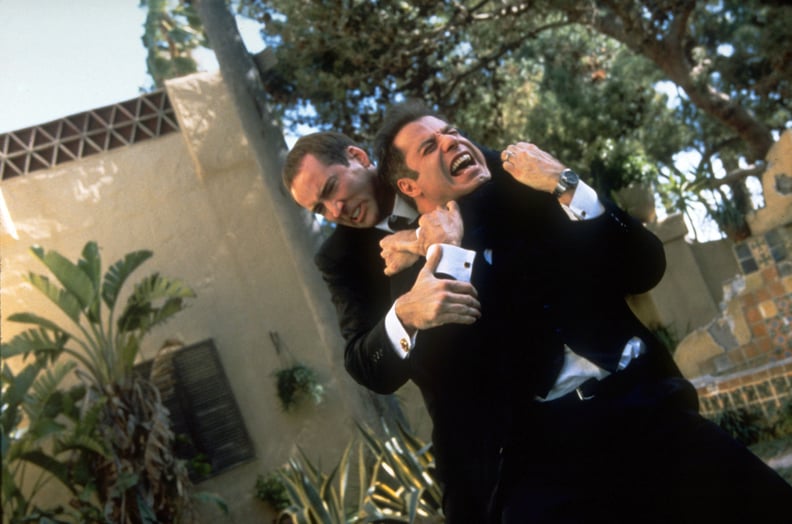
Locate an element on the screen. The image size is (792, 524). plant with large leaves is located at coordinates (74, 272), (29, 342), (21, 386), (51, 396), (145, 290).